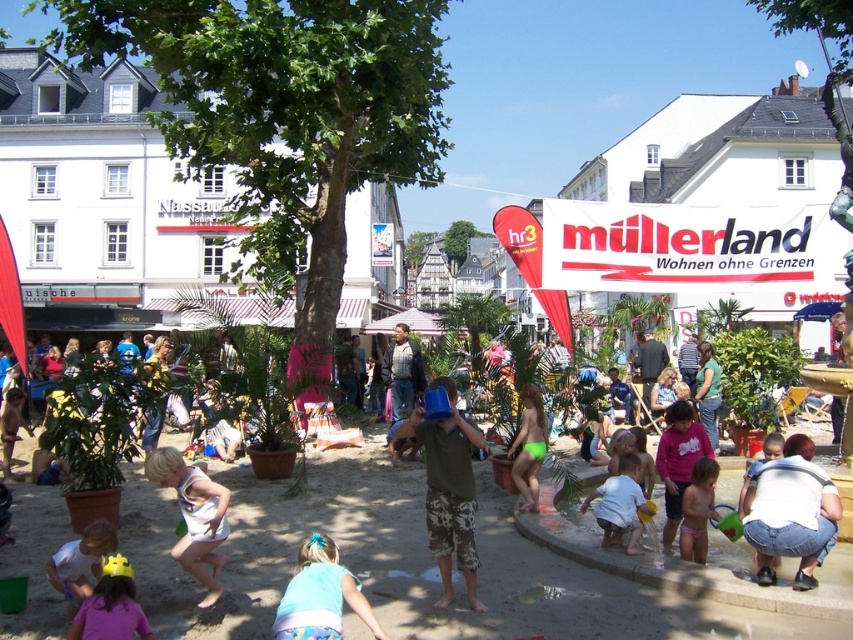
Who is positioned more to the left, brown cotton shirt at center or white matte sand at center?

From the viewer's perspective, brown cotton shirt at center appears more on the left side.

Can you confirm if brown cotton shirt at center is positioned below white matte sand at center?

A: Actually, brown cotton shirt at center is above white matte sand at center.

Looking at this image, measure the distance between point (454, 460) and camera.

They are 43.44 meters apart.

The height and width of the screenshot is (640, 853). What are the coordinates of `brown cotton shirt at center` in the screenshot? It's located at pos(451,493).

Is point (160, 509) closer to viewer compared to point (582, 506)?

No.

At what (x,y) coordinates should I click in order to perform the action: click on light brown sand at center. Please return your answer as a coordinate pair (x, y). The image size is (853, 640). Looking at the image, I should click on (410, 564).

Can you confirm if denim jeans at lower right is bigger than yellow plastic crown at lower left?

Indeed, denim jeans at lower right has a larger size compared to yellow plastic crown at lower left.

Looking at this image, does denim jeans at lower right lie behind yellow plastic crown at lower left?

Yes, denim jeans at lower right is further from the viewer.

Is point (831, 522) more distant than point (73, 628)?

Yes, it is.

I want to click on denim jeans at lower right, so click(x=790, y=513).